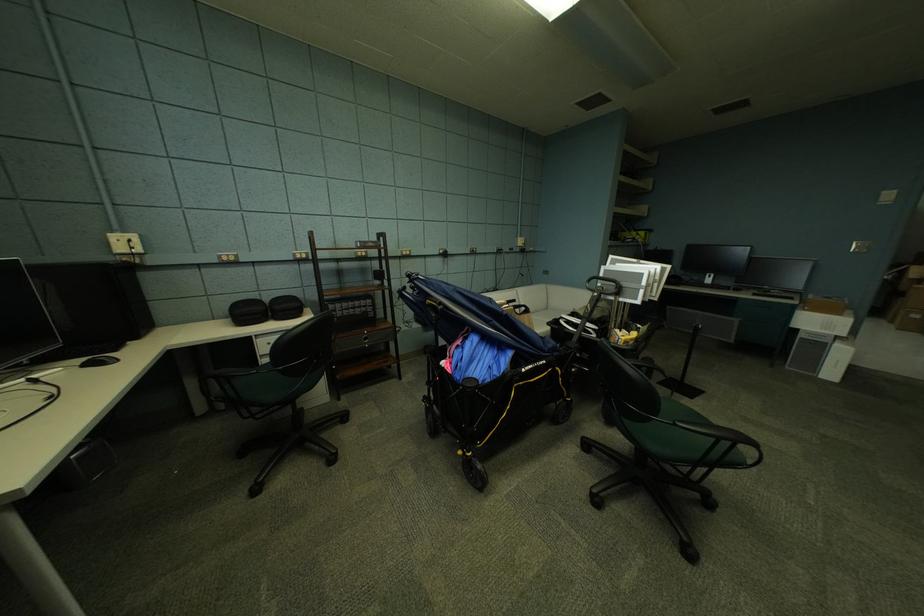
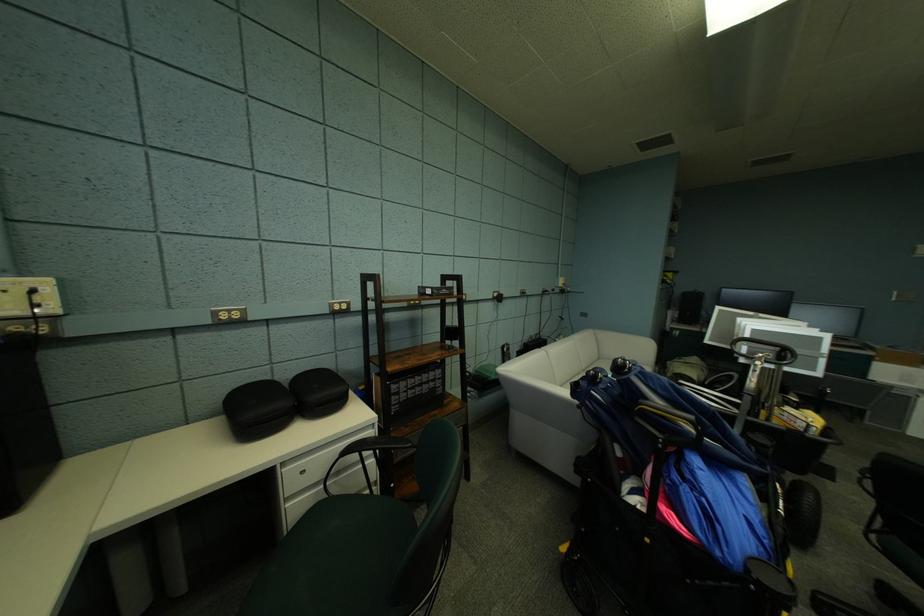
Locate, in the second image, the point that corresponds to pixel 611 286 in the first image.

(758, 349)